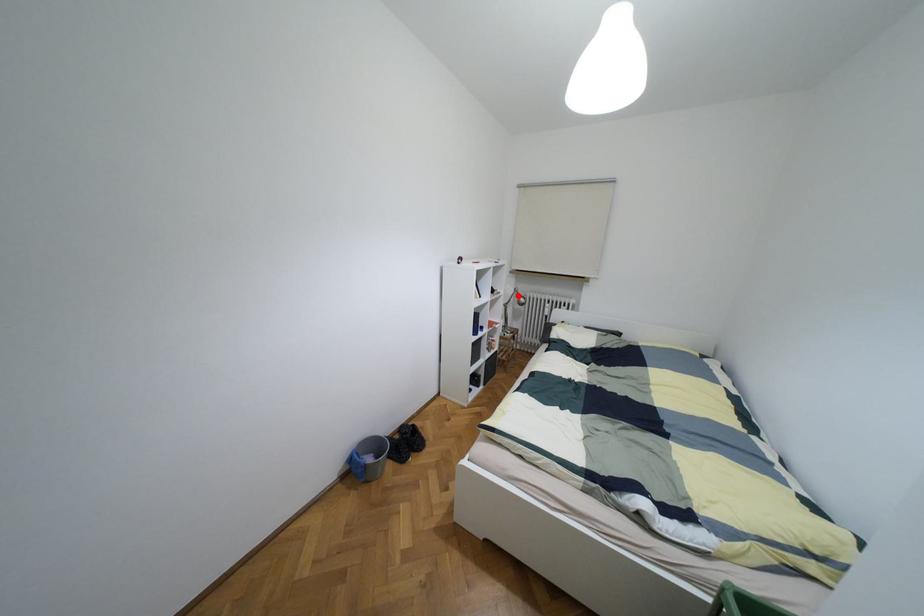
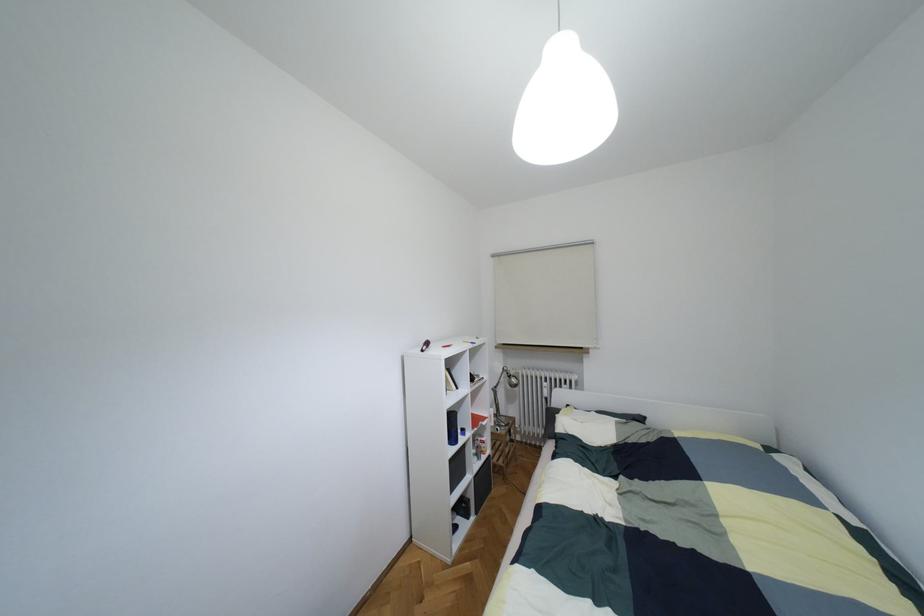
In the second image, find the point that corresponds to the highlighted location in the first image.

(508, 376)